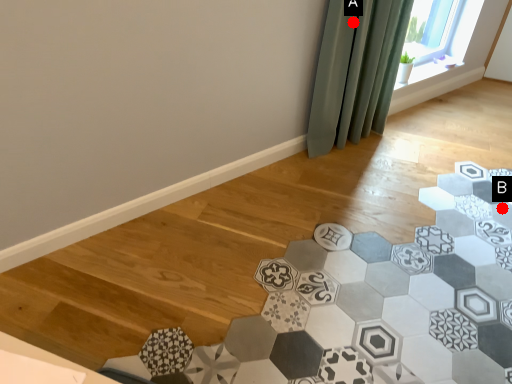
Question: Two points are circled on the image, labeled by A and B beside each circle. Among these points, which one is nearest to the camera?

Choices:
 (A) A is closer
 (B) B is closer

Answer: (A)